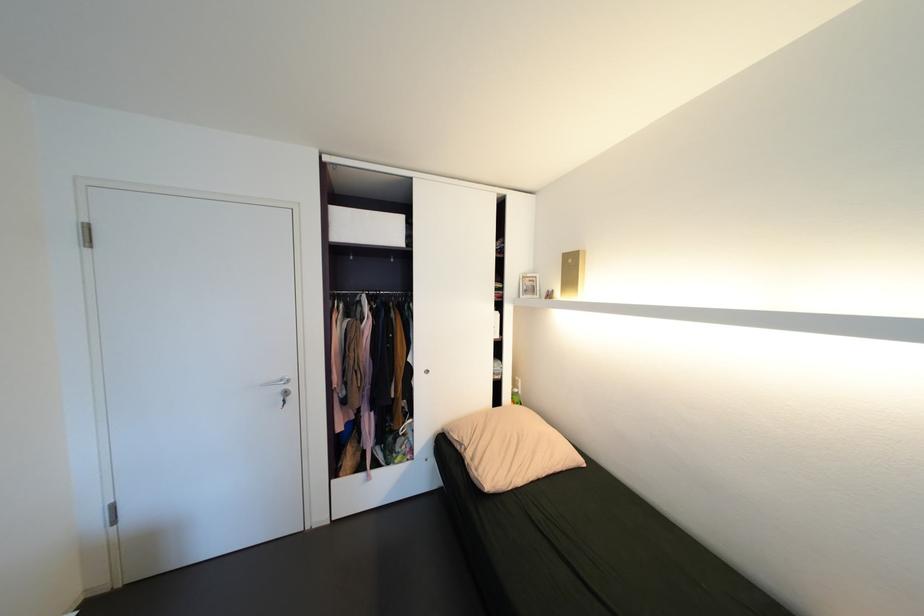
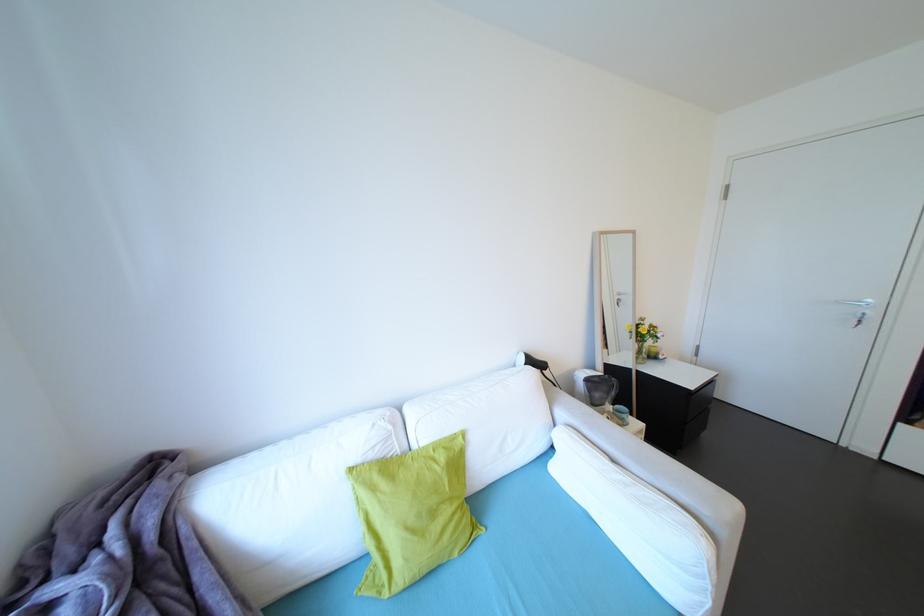
Find the pixel in the second image that matches point (290, 392) in the first image.

(868, 315)